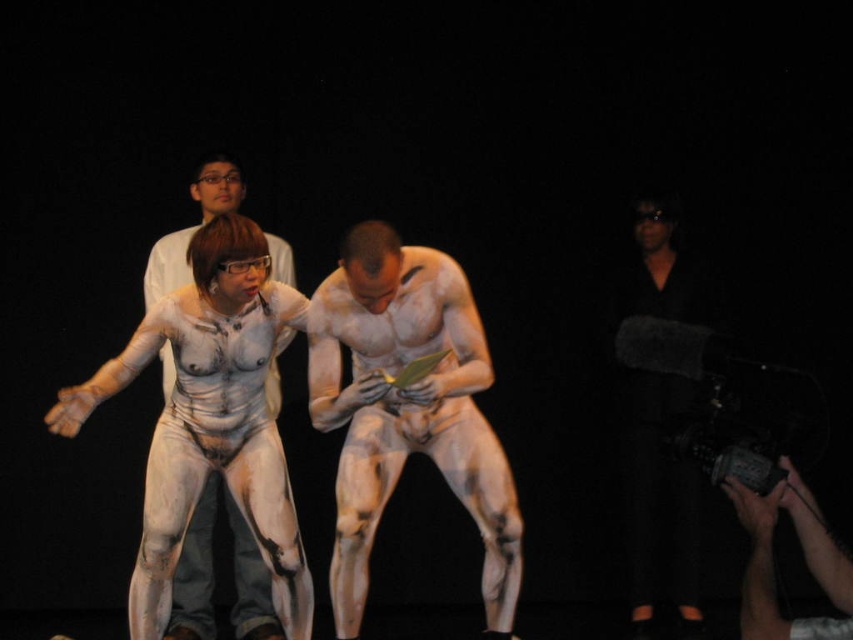
You are an art critic analyzing the spatial arrangement of the performers in the image. Which of the two points, point (337,586) or point (223,204), is positioned closer to the viewer?

Point (337,586) is closer to the viewer than point (223,204).

From the picture: You are a photographer trying to capture the exact center of the image. Based on the scene description, where should you aim your camera to ensure the white matte body paint at center is perfectly centered?

The white matte body paint at center is already positioned at point (407, 412), so you should aim your camera at that coordinate to center it.